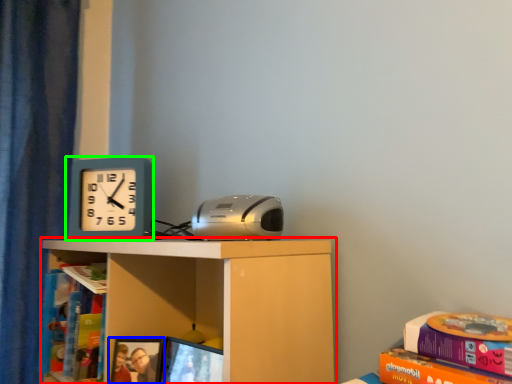
Question: Which object is the closest to the shelf (highlighted by a red box)? Choose among these: picture frame (highlighted by a blue box) or wall clock (highlighted by a green box).

Choices:
 (A) picture frame
 (B) wall clock

Answer: (A)